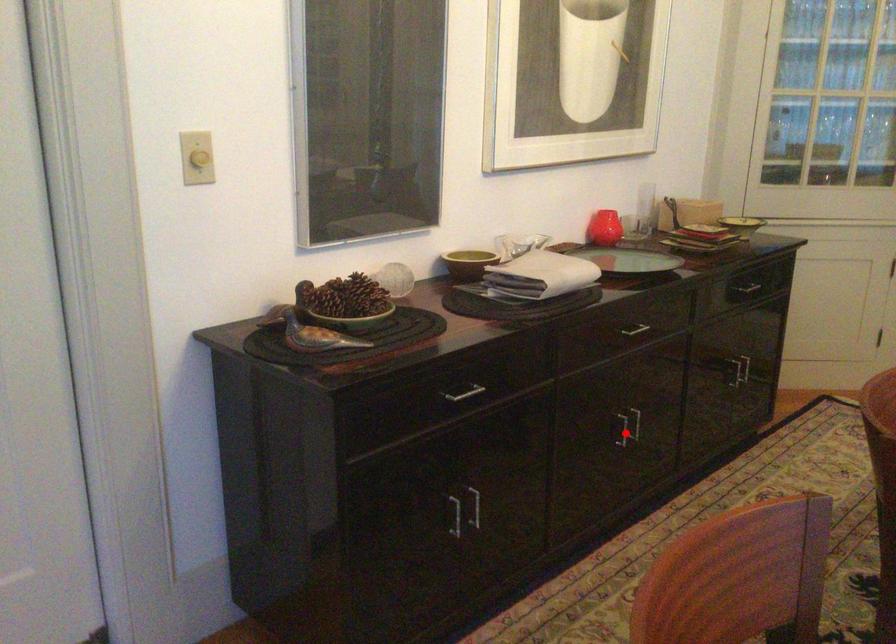
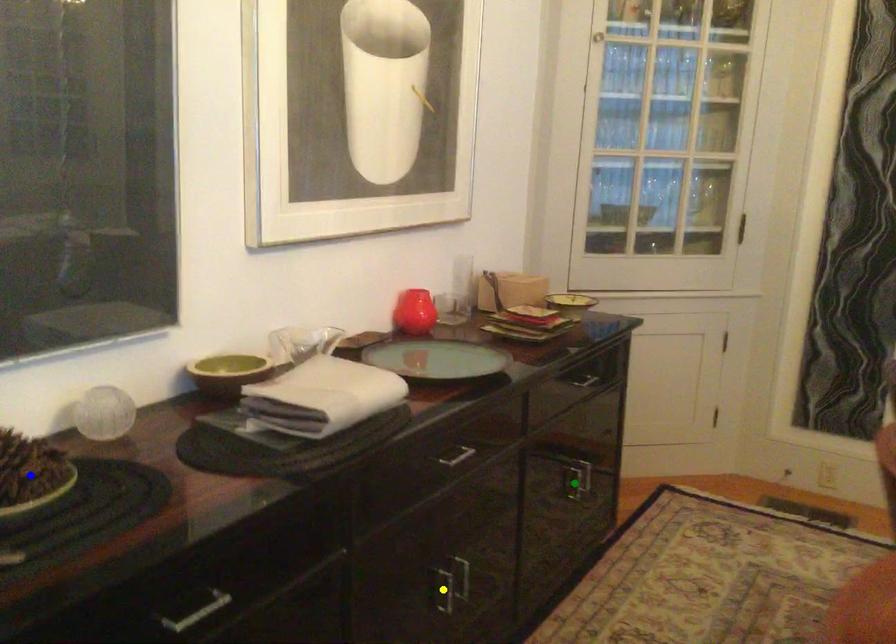
Question: I am providing you with two images of the same scene from different viewpoints. A red point is marked on the first image. You are given multiple points on the second image. Can you choose the point in image 2 that corresponds to the point in image 1?

Choices:
 (A) yellow point
 (B) green point
 (C) blue point

Answer: (A)